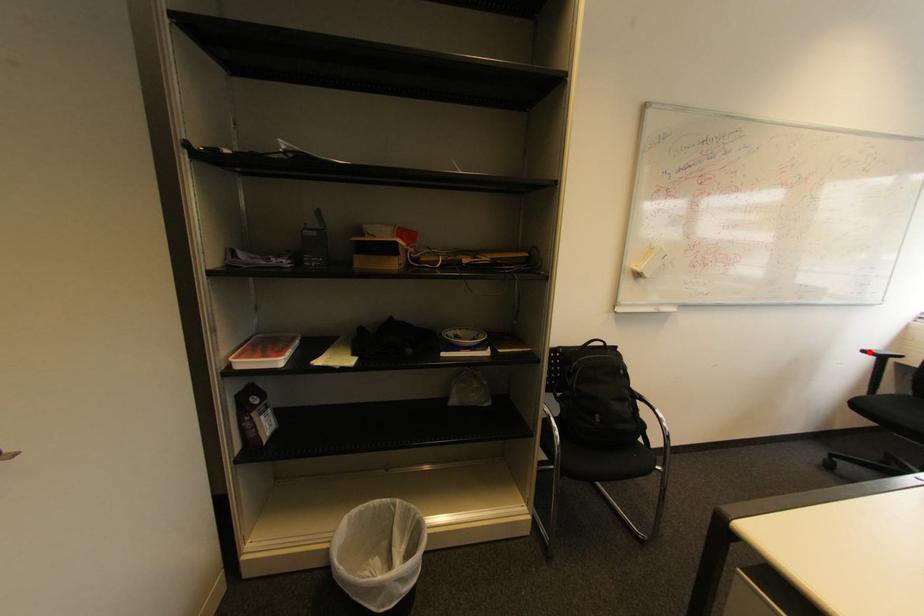
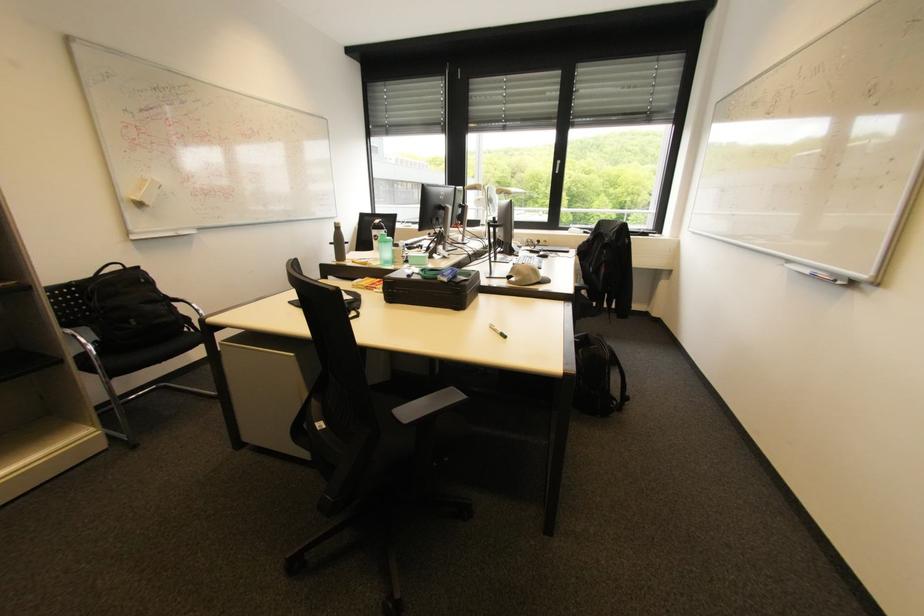
The point at the highlighted location is marked in the first image. Where is the corresponding point in the second image?

(335, 244)